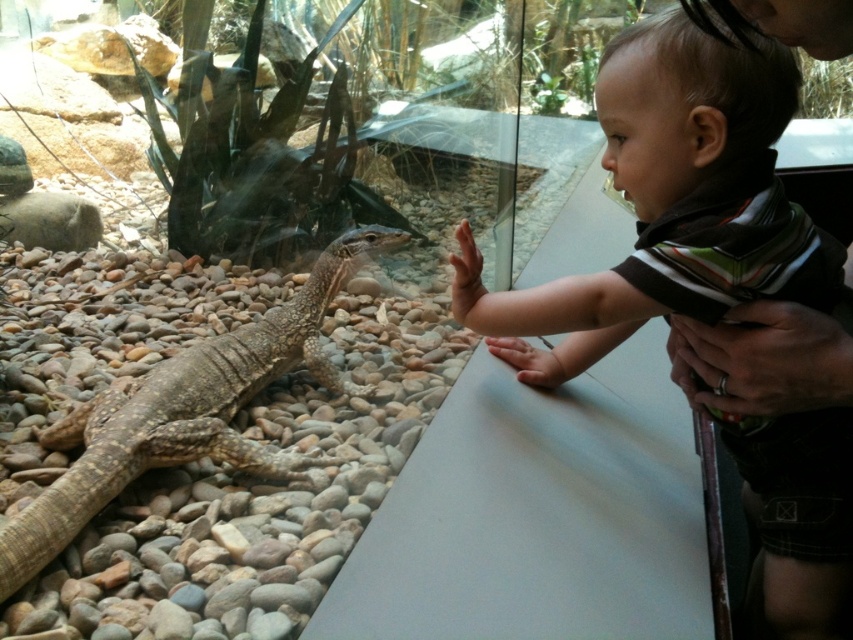
You are a zookeeper responsible for ensuring visitor safety. The baby, smooth brown toddler at center, is reaching towards the brown textured lizard at left. Based on their positions, which direction should you guide the baby to move to stay safely away from the lizard?

The smooth brown toddler at center should be guided to move to the right since they are already to the right of the brown textured lizard at left, maintaining a safe distance.

You are a zookeeper planning to place a new sign near the point marked at coordinates (671, 202). What should the sign indicate about the location of the smooth brown toddler at center?

The point at coordinates (671, 202) represents the location of the smooth brown toddler at center in the exhibit.

You are a zookeeper responsible for ensuring safety in the reptile exhibit. You need to determine if the smooth brown toddler at center can safely reach the brown textured lizard at left without touching the glass. Based on their sizes, can the toddler fit through the space between the lizard and the glass?

The smooth brown toddler at center is thinner than the brown textured lizard at left, so the toddler is thinner than the lizard. Since the lizard is already positioned between the toddler and the glass, the toddler would not need to pass through the space between the lizard and the glass to reach the lizard. However, if the toddler were to attempt to reach through that space, their thinner frame might allow them to fit, but this depends on the exact dimensions of the enclosure and the distance between the 2